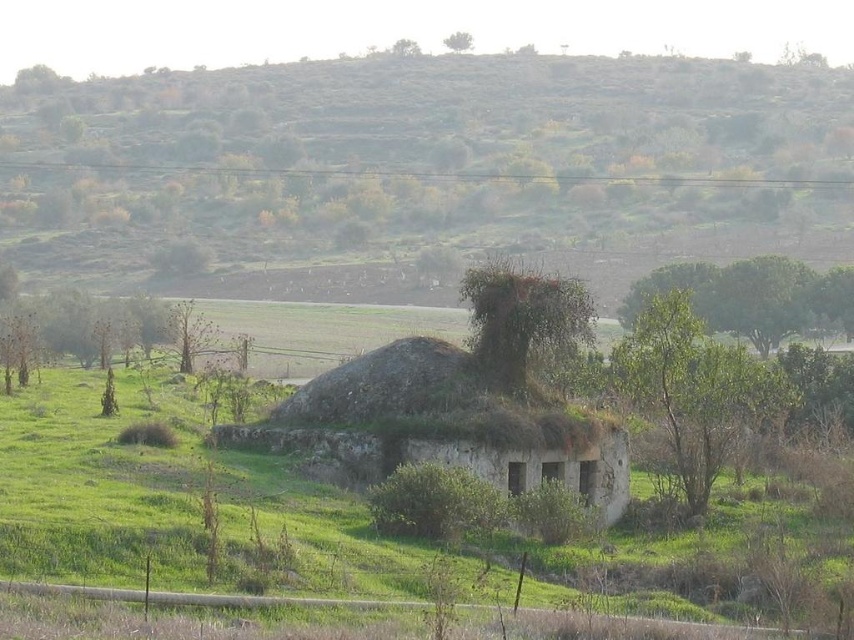
Who is taller, green grassy hillside at upper center or green grassy at center?

With more height is green grassy hillside at upper center.

Is green grassy hillside at upper center closer to the viewer compared to green grassy at center?

No, it is behind green grassy at center.

Is point (527, 220) farther from viewer compared to point (79, 472)?

Yes, it is.

This screenshot has height=640, width=854. What are the coordinates of `green grassy hillside at upper center` in the screenshot? It's located at (422, 172).